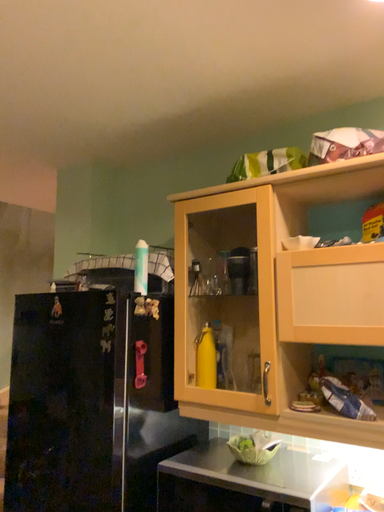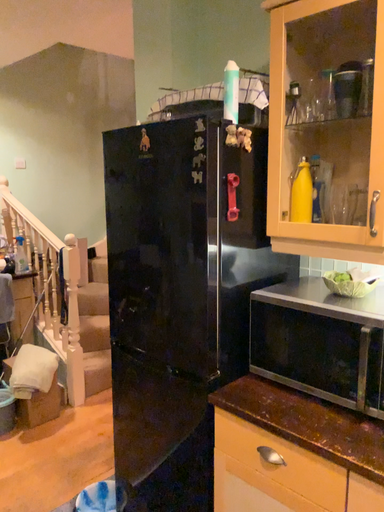
Question: Which way did the camera rotate in the video?

Choices:
 (A) rotated right
 (B) rotated left

Answer: (B)